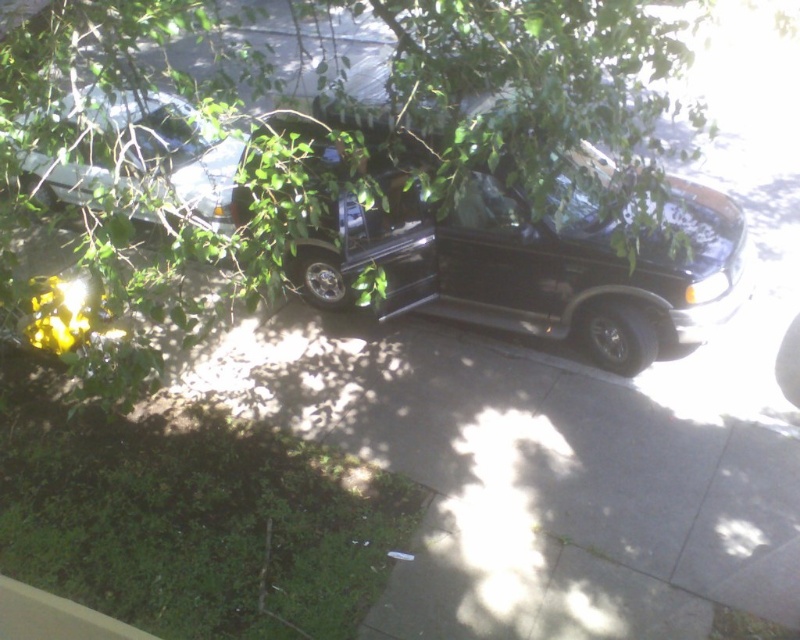
You are a delivery person trying to park your delivery van. You see the metallic silver car at upper left and the gray concrete curb at lower left. Which object is higher in height?

The metallic silver car at upper left is taller than the gray concrete curb at lower left according to the description.

You are a delivery driver who needs to park your vehicle between the metallic silver car at upper left and the gray concrete curb at lower left. Is there enough space between them for your vehicle?

The metallic silver car at upper left is to the left of gray concrete curb at lower left, so there is space between them for your vehicle to park.

You are a parking attendant and need to guide a driver to park their car in a spot that is not occupied. The metallic silver car at upper left is currently blocking part of the parking area. Based on its position at point 0.231, 0.209, can you determine if there is enough space to maneuver around it?

The metallic silver car at upper left is located at point (166, 147). Since the coordinates indicate its position, there might be space to maneuver around it depending on the parking area layout, but specific measurements are needed to confirm.